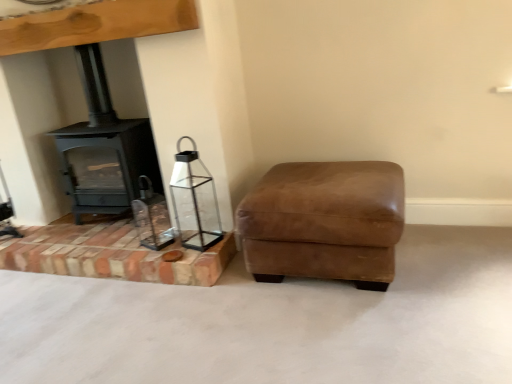
Question: Does suede brown ottoman at lower right have a lesser width compared to matte black wood burning stove at left?

Choices:
 (A) yes
 (B) no

Answer: (B)

Question: Can matte black wood burning stove at left be found inside suede brown ottoman at lower right?

Choices:
 (A) yes
 (B) no

Answer: (B)

Question: Considering the relative sizes of suede brown ottoman at lower right and matte black wood burning stove at left in the image provided, is suede brown ottoman at lower right smaller than matte black wood burning stove at left?

Choices:
 (A) no
 (B) yes

Answer: (A)

Question: Is suede brown ottoman at lower right facing towards matte black wood burning stove at left?

Choices:
 (A) yes
 (B) no

Answer: (B)

Question: Can you confirm if suede brown ottoman at lower right is positioned to the right of matte black wood burning stove at left?

Choices:
 (A) yes
 (B) no

Answer: (A)

Question: Is clear glass lantern at lower left wider or thinner than matte black wood burning stove at left?

Choices:
 (A) thin
 (B) wide

Answer: (A)

Question: Does point (188, 238) appear closer or farther from the camera than point (110, 150)?

Choices:
 (A) farther
 (B) closer

Answer: (B)

Question: Considering their positions, is clear glass lantern at lower left located in front of or behind matte black wood burning stove at left?

Choices:
 (A) front
 (B) behind

Answer: (A)

Question: In terms of height, does clear glass lantern at lower left look taller or shorter compared to matte black wood burning stove at left?

Choices:
 (A) short
 (B) tall

Answer: (A)

Question: Is clear glass lantern at lower left taller or shorter than suede brown ottoman at lower right?

Choices:
 (A) tall
 (B) short

Answer: (A)

Question: In terms of width, does clear glass lantern at lower left look wider or thinner when compared to suede brown ottoman at lower right?

Choices:
 (A) thin
 (B) wide

Answer: (A)

Question: From the image's perspective, relative to suede brown ottoman at lower right, is clear glass lantern at lower left above or below?

Choices:
 (A) below
 (B) above

Answer: (B)

Question: From a real-world perspective, is clear glass lantern at lower left positioned above or below suede brown ottoman at lower right?

Choices:
 (A) below
 (B) above

Answer: (B)

Question: Visually, is suede brown ottoman at lower right positioned to the left or to the right of matte black wood burning stove at left?

Choices:
 (A) right
 (B) left

Answer: (A)

Question: In terms of size, does suede brown ottoman at lower right appear bigger or smaller than matte black wood burning stove at left?

Choices:
 (A) big
 (B) small

Answer: (A)